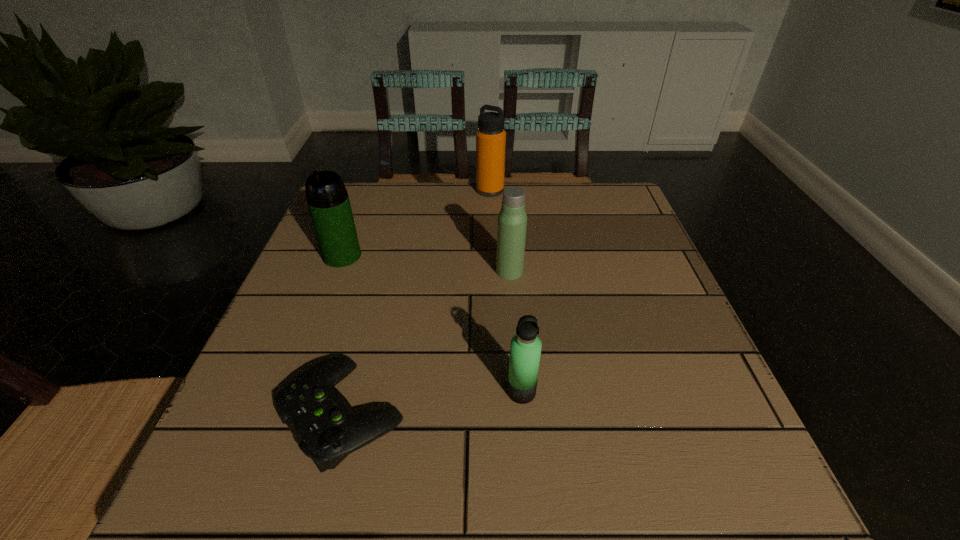
What are the coordinates of `unoccupied area between the farthest thermos bottle and the nearest thermos bottle` in the screenshot? It's located at (506, 291).

Identify the location of free spot between the farthest object and the leftmost thermos bottle. This screenshot has width=960, height=540. (416, 223).

Find the location of a particular element. free space between the farthest object and the shortest object is located at coordinates [417, 302].

Find the location of `free space between the farthest thermos bottle and the leftmost thermos bottle`. free space between the farthest thermos bottle and the leftmost thermos bottle is located at coordinates (416, 223).

Locate an element on the screen. This screenshot has width=960, height=540. vacant point located between the nearest thermos bottle and the control is located at coordinates (432, 402).

Identify the location of vacant region between the control and the farthest object. (417, 302).

Where is `vacant region between the nearest thermos bottle and the control`? The height and width of the screenshot is (540, 960). vacant region between the nearest thermos bottle and the control is located at coordinates (432, 402).

You are a GUI agent. You are given a task and a screenshot of the screen. Output one action in this format:
    pyautogui.click(x=<x>, y=<y>)
    Task: Click on the object that can be found as the second closest to the control
    
    Given the screenshot: What is the action you would take?
    pyautogui.click(x=327, y=198)

You are a GUI agent. You are given a task and a screenshot of the screen. Output one action in this format:
    pyautogui.click(x=<x>, y=<y>)
    Task: Click on the object that stands as the second closest to the farthest object
    This screenshot has height=540, width=960.
    Given the screenshot: What is the action you would take?
    pyautogui.click(x=327, y=198)

This screenshot has height=540, width=960. What are the coordinates of `thermos bottle that is the third closest to the control` in the screenshot? It's located at (512, 219).